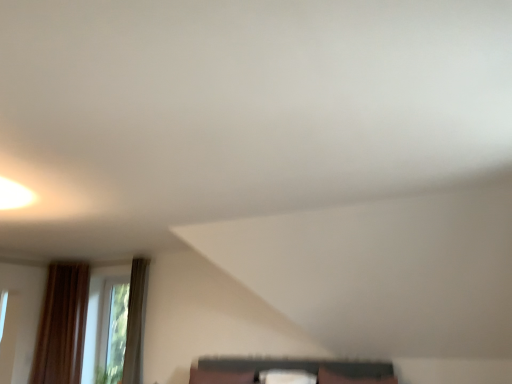
Question: Based on their sizes in the image, would you say white fabric pillow at center, the 2th pillow positioned from the left, is bigger or smaller than transparent glass window at lower left?

Choices:
 (A) small
 (B) big

Answer: (A)

Question: From a real-world perspective, is white fabric pillow at center, the 1th pillow in the right-to-left sequence, positioned above or below transparent glass window at lower left?

Choices:
 (A) below
 (B) above

Answer: (A)

Question: Estimate the real-world distances between objects in this image. Which object is farther from the matte black shelf at lower center?

Choices:
 (A) brown fabric pillow at lower center, which ranks as the 1th pillow in left-to-right order
 (B) white fabric pillow at center, the 1th pillow in the right-to-left sequence
 (C) transparent glass window at lower left

Answer: (C)

Question: Based on their relative distances, which object is farther from the brown fabric pillow at lower center, acting as the 2th pillow starting from the right?

Choices:
 (A) matte black shelf at lower center
 (B) white fabric pillow at center, the 1th pillow in the right-to-left sequence
 (C) transparent glass window at lower left

Answer: (C)